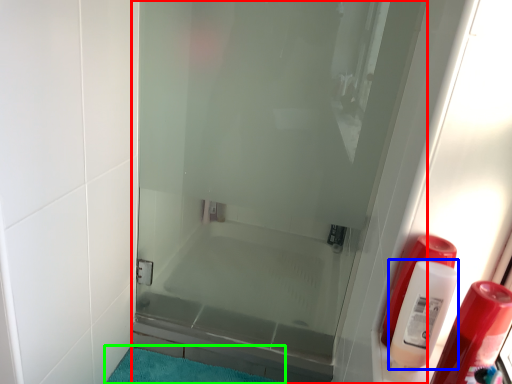
Question: Which is farther away from door (highlighted by a red box)? cleaning product (highlighted by a blue box) or bath mat (highlighted by a green box)?

Choices:
 (A) cleaning product
 (B) bath mat

Answer: (A)